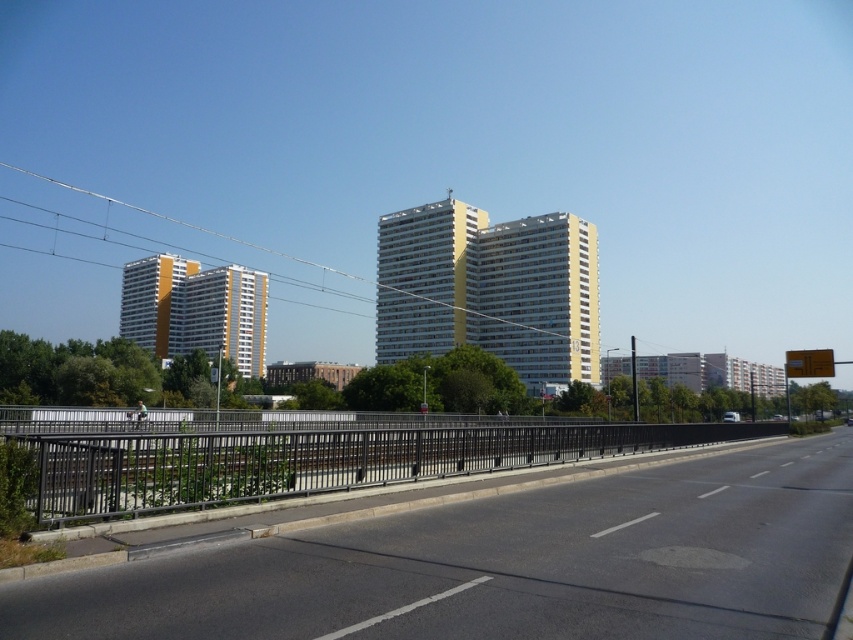
Question: Is black asphalt highway at center above metallic wire at upper center?

Choices:
 (A) no
 (B) yes

Answer: (A)

Question: Is black asphalt highway at center further to the viewer compared to metallic wire at upper center?

Choices:
 (A) yes
 (B) no

Answer: (B)

Question: Among these objects, which one is nearest to the camera?

Choices:
 (A) metallic wire at upper center
 (B) black asphalt highway at center

Answer: (B)

Question: Which point is closer to the camera taking this photo?

Choices:
 (A) (115, 576)
 (B) (463, 225)

Answer: (A)

Question: Can you confirm if black asphalt highway at center is thinner than metallic wire at upper center?

Choices:
 (A) yes
 (B) no

Answer: (A)